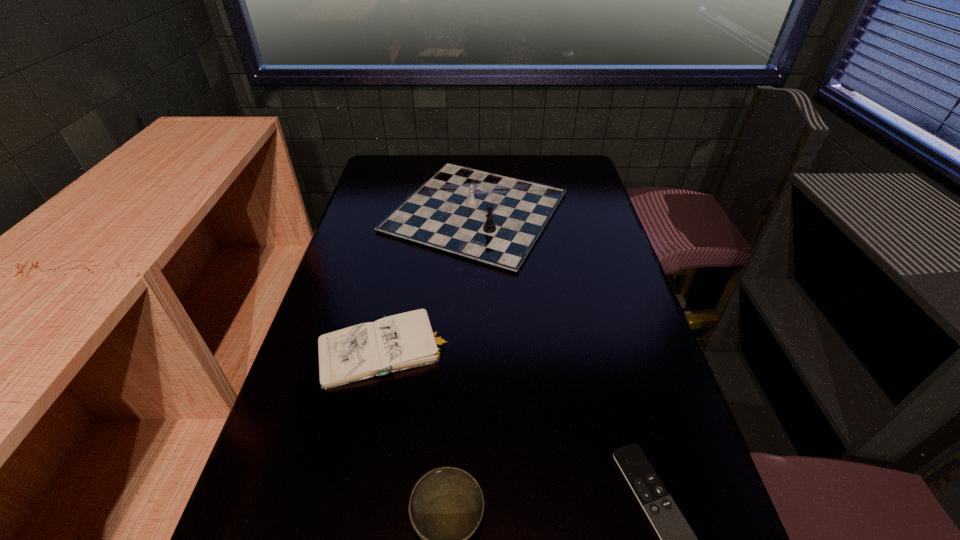
The height and width of the screenshot is (540, 960). I want to click on object present at the far left corner, so click(495, 219).

Find the location of `object that is positioned at the far right corner`. object that is positioned at the far right corner is located at coordinates (495, 219).

Where is `free space at the left edge`? The width and height of the screenshot is (960, 540). free space at the left edge is located at coordinates 272,480.

Locate an element on the screen. free space at the far right corner of the desktop is located at coordinates (568, 169).

Where is `free space that is in between the farthest object and the notebook`? The height and width of the screenshot is (540, 960). free space that is in between the farthest object and the notebook is located at coordinates (431, 280).

This screenshot has height=540, width=960. What are the coordinates of `the closest object to the shortest object` in the screenshot? It's located at point(446,506).

Select which object is the second closest to the farthest object. Please provide its 2D coordinates. Your answer should be formatted as a tuple, i.e. [(x, y)], where the tuple contains the x and y coordinates of a point satisfying the conditions above.

[(677, 539)]

Locate an element on the screen. vacant area in the image that satisfies the following two spatial constraints: 1. on the back side of the notebook; 2. on the left side of the gameboard is located at coordinates (414, 212).